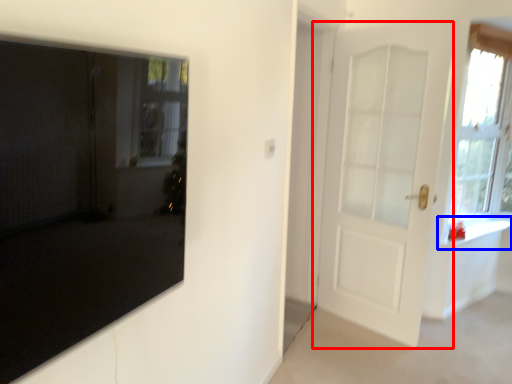
Question: Which object is closer to the camera taking this photo, door (highlighted by a red box) or window sill (highlighted by a blue box)?

Choices:
 (A) door
 (B) window sill

Answer: (A)